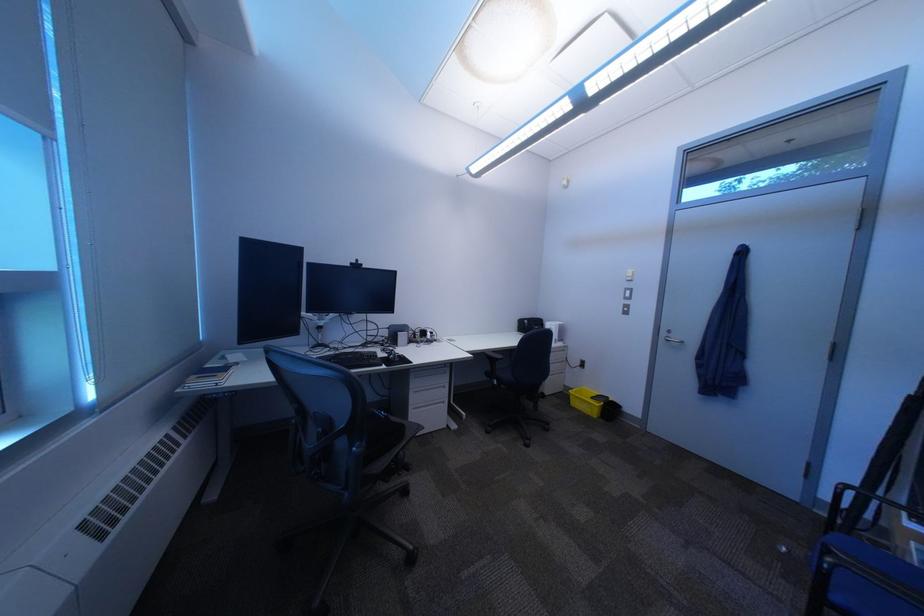
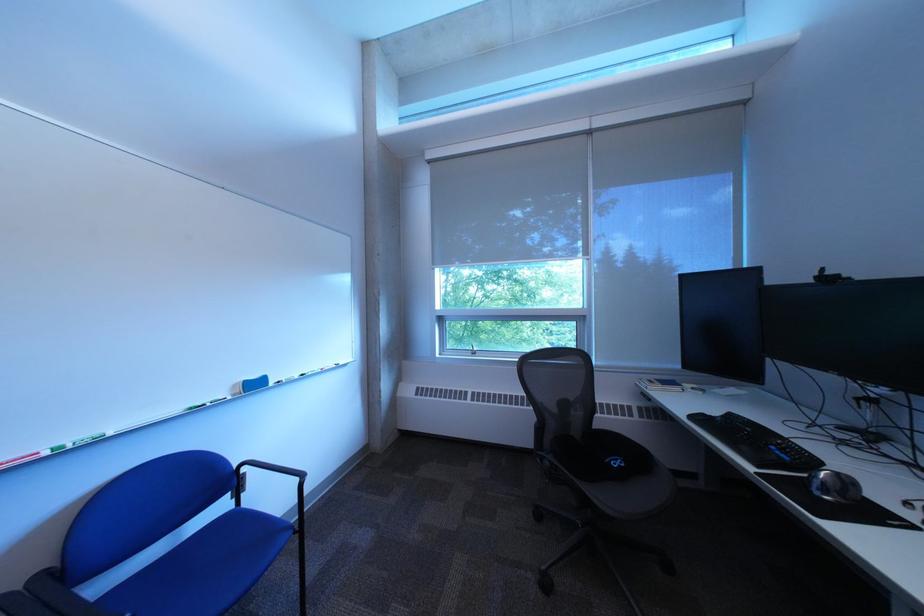
Locate, in the second image, the point that corresponds to point (373, 265) in the first image.

(843, 275)